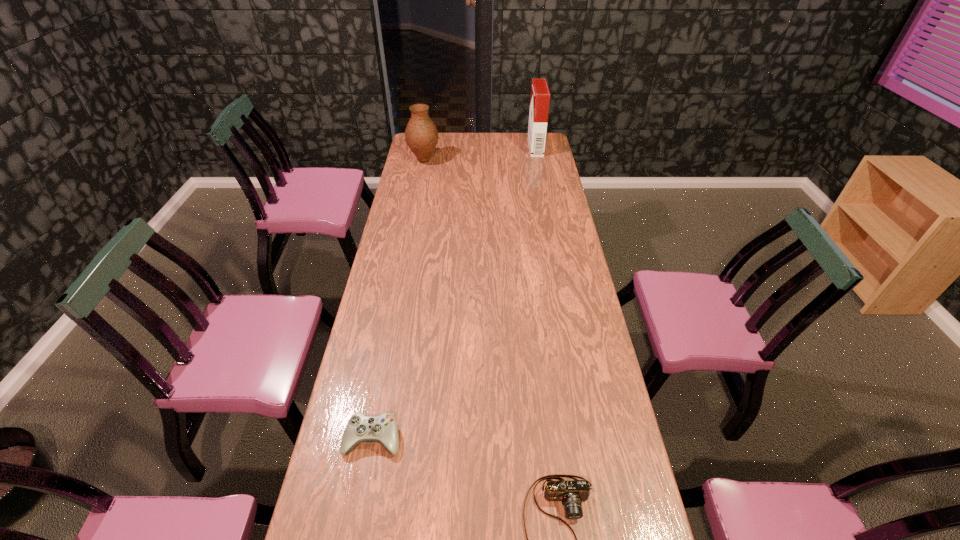
Locate an element on the screen. control that is at the left edge is located at coordinates (382, 429).

I want to click on object situated at the right edge, so click(540, 96).

What are the coordinates of `object positioned at the far right corner` in the screenshot? It's located at (540, 96).

The image size is (960, 540). Find the location of `free region at the far edge of the desktop`. free region at the far edge of the desktop is located at coordinates (511, 151).

Where is `vacant region at the left edge of the desktop`? vacant region at the left edge of the desktop is located at coordinates (411, 159).

The height and width of the screenshot is (540, 960). Identify the location of blank space at the right edge. [x=578, y=363].

I want to click on vacant area that lies between the cigarette_case and the third farthest object, so click(454, 293).

Locate which object ranks third in proximity to the cigarette_case. Please provide its 2D coordinates. Your answer should be formatted as a tuple, i.e. [(x, y)], where the tuple contains the x and y coordinates of a point satisfying the conditions above.

[(572, 492)]

What are the coordinates of `object that can be found as the second closest to the nearest object` in the screenshot? It's located at (421, 134).

Identify the location of blank area in the image that satisfies the following two spatial constraints: 1. on the front-facing side of the cigarette_case; 2. on the front side of the third shortest object. (538, 160).